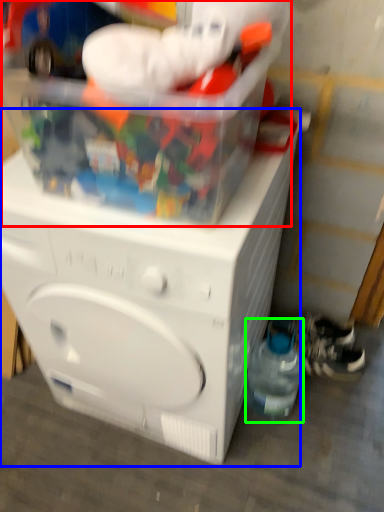
Question: Which is nearer to the toy (highlighted by a red box)? washing machine (highlighted by a blue box) or bottle (highlighted by a green box).

Choices:
 (A) washing machine
 (B) bottle

Answer: (A)